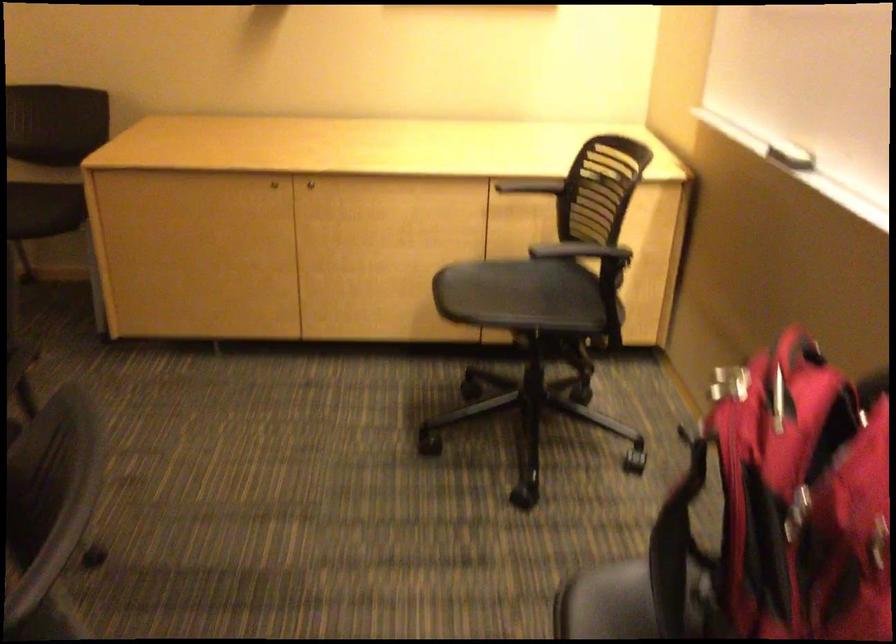
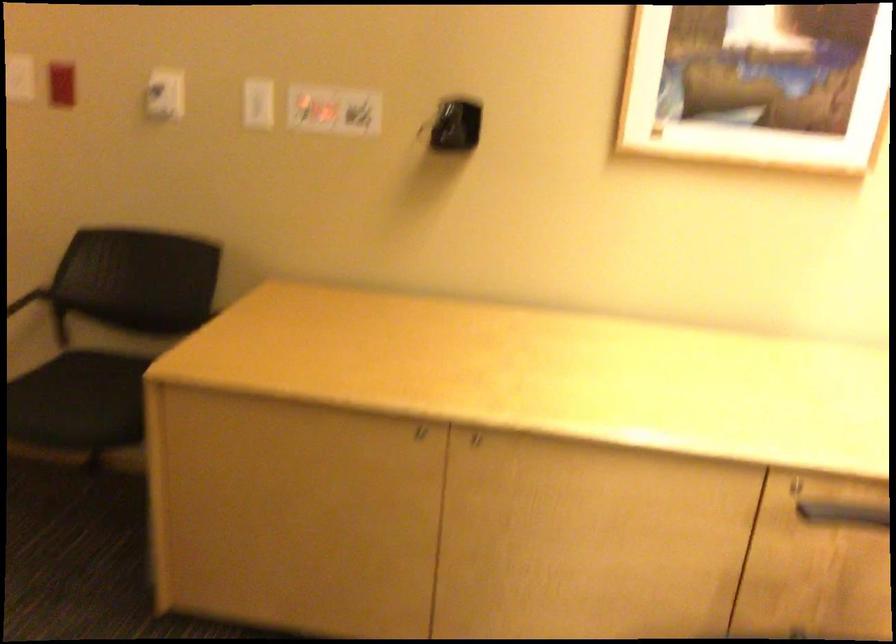
In the second image, find the point that corresponds to [297,184] in the first image.

(472, 437)